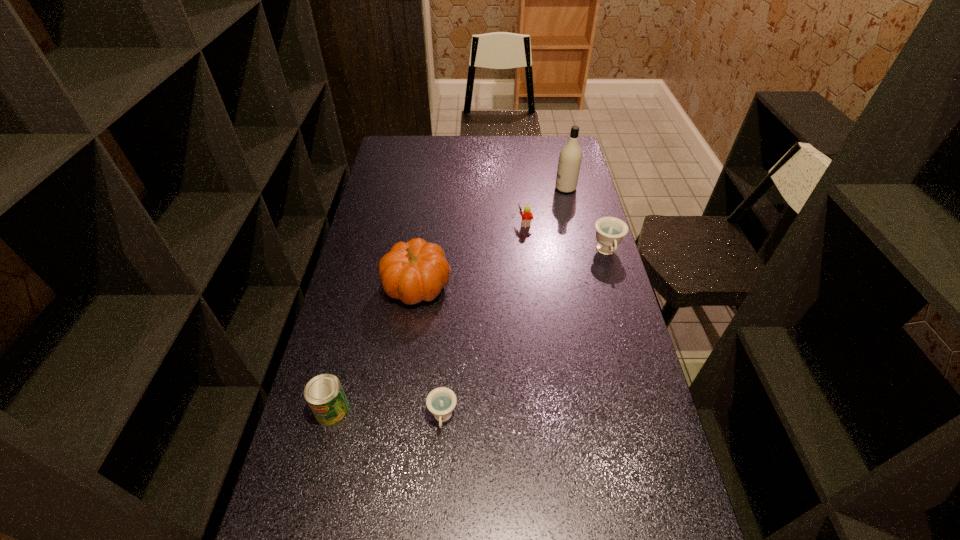
Locate an element on the screen. This screenshot has width=960, height=540. the shorter teacup is located at coordinates (441, 401).

At what (x,y) coordinates should I click in order to perform the action: click on the shortest object. Please return your answer as a coordinate pair (x, y). This screenshot has height=540, width=960. Looking at the image, I should click on (441, 401).

Where is `the right teacup`? The height and width of the screenshot is (540, 960). the right teacup is located at coordinates (610, 231).

Find the location of a particular element. the farther teacup is located at coordinates (610, 231).

Where is `the second farthest object`? This screenshot has width=960, height=540. the second farthest object is located at coordinates (527, 216).

Locate an element on the screen. the third object from right to left is located at coordinates (527, 216).

You are a GUI agent. You are given a task and a screenshot of the screen. Output one action in this format:
    pyautogui.click(x=<x>, y=<y>)
    Task: Click on the tallest object
    The height and width of the screenshot is (540, 960).
    Given the screenshot: What is the action you would take?
    pyautogui.click(x=570, y=157)

The image size is (960, 540). In order to click on the farthest object in this screenshot , I will do `click(570, 157)`.

At what (x,y) coordinates should I click in order to perform the action: click on the leftmost object. Please return your answer as a coordinate pair (x, y). Looking at the image, I should click on (324, 394).

I want to click on pumpkin, so coord(414,271).